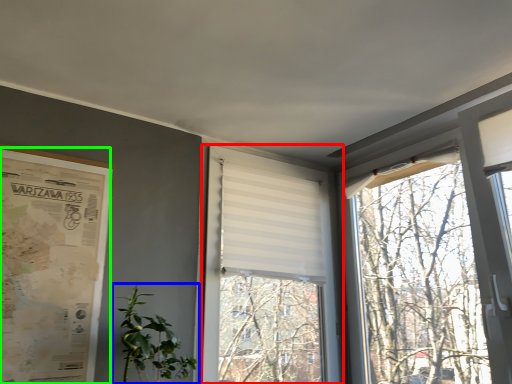
Question: Which object is positioned closest to window (highlighted by a red box)? Select from houseplant (highlighted by a blue box) and poster page (highlighted by a green box).

Choices:
 (A) houseplant
 (B) poster page

Answer: (A)